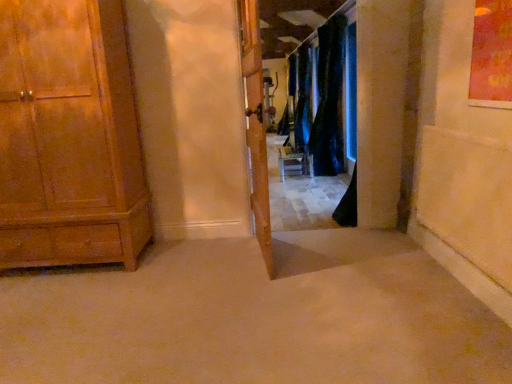
You are a GUI agent. You are given a task and a screenshot of the screen. Output one action in this format:
    pyautogui.click(x=<x>, y=<y>)
    Task: Click on the black velvet curtain at center, which is the second curtain from back to front
    
    Given the screenshot: What is the action you would take?
    pyautogui.click(x=321, y=98)

I want to click on dark blue velvet curtains at center, arranged as the 1th curtain when viewed from the back, so click(302, 99).

Where is `wooden cabinet at left`? This screenshot has height=384, width=512. wooden cabinet at left is located at coordinates (69, 137).

Locate an element on the screen. Image resolution: width=512 pixels, height=384 pixels. cabinetry that appears in front of the dark blue velvet curtains at center, arranged as the 2th curtain when viewed from the front is located at coordinates (69, 137).

From a real-world perspective, is wooden cabinet at left over dark blue velvet curtains at center, arranged as the 2th curtain when viewed from the front?

No, from a real-world perspective, wooden cabinet at left is not on top of dark blue velvet curtains at center, arranged as the 2th curtain when viewed from the front.

Considering the relative sizes of wooden cabinet at left and dark blue velvet curtains at center, arranged as the 2th curtain when viewed from the front, in the image provided, is wooden cabinet at left shorter than dark blue velvet curtains at center, arranged as the 2th curtain when viewed from the front,?

Correct, wooden cabinet at left is not as tall as dark blue velvet curtains at center, arranged as the 2th curtain when viewed from the front.

Is wooden cabinet at left aimed at dark blue velvet curtains at center, arranged as the 2th curtain when viewed from the front?

No, wooden cabinet at left is not aimed at dark blue velvet curtains at center, arranged as the 2th curtain when viewed from the front.

Is dark blue velvet curtains at center, arranged as the 1th curtain when viewed from the back, looking in the opposite direction of wooden cabinet at left?

dark blue velvet curtains at center, arranged as the 1th curtain when viewed from the back, is not turned away from wooden cabinet at left.

From a real-world perspective, which object rests below the other?

From a 3D spatial view, wooden cabinet at left is below.

Considering the relative positions of dark blue velvet curtains at center, arranged as the 1th curtain when viewed from the back, and wooden cabinet at left in the image provided, is dark blue velvet curtains at center, arranged as the 1th curtain when viewed from the back, to the left or to the right of wooden cabinet at left?

Based on their positions, dark blue velvet curtains at center, arranged as the 1th curtain when viewed from the back, is located to the right of wooden cabinet at left.

Identify the location of door that is below the black velvet curtain at center, which is the second curtain from back to front (from the image's perspective). (256, 125).

Which is in front, wooden door at center or black velvet curtain at center, which is the second curtain from back to front?

wooden door at center is closer to the camera.

Can we say wooden door at center lies outside black velvet curtain at center, which is the second curtain from back to front?

Yes, wooden door at center is outside of black velvet curtain at center, which is the second curtain from back to front.

Can you confirm if wooden door at center is shorter than black velvet curtain at center, which is counted as the 1th curtain, starting from the front?

Indeed, wooden door at center has a lesser height compared to black velvet curtain at center, which is counted as the 1th curtain, starting from the front.

Looking at this image, considering the sizes of objects wooden door at center and dark blue velvet curtains at center, arranged as the 1th curtain when viewed from the back, in the image provided, who is bigger, wooden door at center or dark blue velvet curtains at center, arranged as the 1th curtain when viewed from the back,?

Bigger between the two is dark blue velvet curtains at center, arranged as the 1th curtain when viewed from the back.

From a real-world perspective, is wooden door at center over dark blue velvet curtains at center, arranged as the 2th curtain when viewed from the front?

No, from a real-world perspective, wooden door at center is not on top of dark blue velvet curtains at center, arranged as the 2th curtain when viewed from the front.

Is wooden door at center closer to camera compared to dark blue velvet curtains at center, arranged as the 2th curtain when viewed from the front?

Yes, wooden door at center is closer to the camera.

What's the angular difference between wooden door at center and dark blue velvet curtains at center, arranged as the 2th curtain when viewed from the front,'s facing directions?

The facing directions of wooden door at center and dark blue velvet curtains at center, arranged as the 2th curtain when viewed from the front, are 7.94 degrees apart.

Which object is wider, black velvet curtain at center, which is counted as the 1th curtain, starting from the front, or dark blue velvet curtains at center, arranged as the 2th curtain when viewed from the front?

black velvet curtain at center, which is counted as the 1th curtain, starting from the front.

From a real-world perspective, is black velvet curtain at center, which is counted as the 1th curtain, starting from the front, physically below dark blue velvet curtains at center, arranged as the 2th curtain when viewed from the front?

Yes, from a real-world perspective, black velvet curtain at center, which is counted as the 1th curtain, starting from the front, is under dark blue velvet curtains at center, arranged as the 2th curtain when viewed from the front.

Looking at this image, which is more to the left, black velvet curtain at center, which is counted as the 1th curtain, starting from the front, or dark blue velvet curtains at center, arranged as the 1th curtain when viewed from the back?

Positioned to the left is black velvet curtain at center, which is counted as the 1th curtain, starting from the front.

Would you say black velvet curtain at center, which is the second curtain from back to front, is inside or outside dark blue velvet curtains at center, arranged as the 2th curtain when viewed from the front?

black velvet curtain at center, which is the second curtain from back to front, is outside dark blue velvet curtains at center, arranged as the 2th curtain when viewed from the front.

How many degrees apart are the facing directions of dark blue velvet curtains at center, arranged as the 2th curtain when viewed from the front, and black velvet curtain at center, which is the second curtain from back to front?

There is a 0.00337-degree angle between the facing directions of dark blue velvet curtains at center, arranged as the 2th curtain when viewed from the front, and black velvet curtain at center, which is the second curtain from back to front.

Identify the location of curtain that appears above the black velvet curtain at center, which is the second curtain from back to front (from a real-world perspective). Image resolution: width=512 pixels, height=384 pixels. (302, 99).

Does dark blue velvet curtains at center, arranged as the 1th curtain when viewed from the back, have a greater height compared to black velvet curtain at center, which is the second curtain from back to front?

No.

Considering their positions, is dark blue velvet curtains at center, arranged as the 2th curtain when viewed from the front, located in front of or behind black velvet curtain at center, which is counted as the 1th curtain, starting from the front?

dark blue velvet curtains at center, arranged as the 2th curtain when viewed from the front, is behind black velvet curtain at center, which is counted as the 1th curtain, starting from the front.

Looking at this image, from the image's perspective, is dark blue velvet curtains at center, arranged as the 2th curtain when viewed from the front, above or below wooden door at center?

dark blue velvet curtains at center, arranged as the 2th curtain when viewed from the front, is situated higher than wooden door at center in the image.

Considering the sizes of dark blue velvet curtains at center, arranged as the 1th curtain when viewed from the back, and wooden door at center in the image, is dark blue velvet curtains at center, arranged as the 1th curtain when viewed from the back, bigger or smaller than wooden door at center?

dark blue velvet curtains at center, arranged as the 1th curtain when viewed from the back, is bigger than wooden door at center.

Is dark blue velvet curtains at center, arranged as the 2th curtain when viewed from the front, inside or outside of wooden door at center?

dark blue velvet curtains at center, arranged as the 2th curtain when viewed from the front, is not enclosed by wooden door at center.

From a real-world perspective, who is located lower, dark blue velvet curtains at center, arranged as the 1th curtain when viewed from the back, or wooden door at center?

From a 3D spatial view, wooden door at center is below.

Identify the location of cabinetry that is under the dark blue velvet curtains at center, arranged as the 2th curtain when viewed from the front (from a real-world perspective). (69, 137).

Identify the location of cabinetry that is in front of the dark blue velvet curtains at center, arranged as the 1th curtain when viewed from the back. (69, 137).

Which object lies further to the anchor point dark blue velvet curtains at center, arranged as the 2th curtain when viewed from the front, black velvet curtain at center, which is counted as the 1th curtain, starting from the front, or wooden cabinet at left?

The object further to dark blue velvet curtains at center, arranged as the 2th curtain when viewed from the front, is wooden cabinet at left.

Which object lies nearer to the anchor point black velvet curtain at center, which is counted as the 1th curtain, starting from the front, wooden door at center or wooden cabinet at left?

wooden door at center is closer to black velvet curtain at center, which is counted as the 1th curtain, starting from the front.

Consider the image. When comparing their distances from black velvet curtain at center, which is counted as the 1th curtain, starting from the front, does wooden cabinet at left or wooden door at center seem further?

wooden cabinet at left lies further to black velvet curtain at center, which is counted as the 1th curtain, starting from the front, than the other object.

Looking at the image, which one is located closer to wooden cabinet at left, black velvet curtain at center, which is the second curtain from back to front, or dark blue velvet curtains at center, arranged as the 1th curtain when viewed from the back?

The object closer to wooden cabinet at left is black velvet curtain at center, which is the second curtain from back to front.

Looking at the image, which one is located closer to dark blue velvet curtains at center, arranged as the 1th curtain when viewed from the back, black velvet curtain at center, which is the second curtain from back to front, or wooden door at center?

black velvet curtain at center, which is the second curtain from back to front, is closer to dark blue velvet curtains at center, arranged as the 1th curtain when viewed from the back.

When comparing their distances from wooden door at center, does black velvet curtain at center, which is counted as the 1th curtain, starting from the front, or wooden cabinet at left seem further?

Among the two, black velvet curtain at center, which is counted as the 1th curtain, starting from the front, is located further to wooden door at center.

From the image, which object appears to be nearer to wooden cabinet at left, dark blue velvet curtains at center, arranged as the 2th curtain when viewed from the front, or black velvet curtain at center, which is counted as the 1th curtain, starting from the front?

black velvet curtain at center, which is counted as the 1th curtain, starting from the front.

Estimate the real-world distances between objects in this image. Which object is closer to wooden door at center, dark blue velvet curtains at center, arranged as the 1th curtain when viewed from the back, or black velvet curtain at center, which is the second curtain from back to front?

Among the two, black velvet curtain at center, which is the second curtain from back to front, is located nearer to wooden door at center.

At what (x,y) coordinates should I click in order to perform the action: click on curtain between wooden cabinet at left and dark blue velvet curtains at center, arranged as the 2th curtain when viewed from the front, from front to back. Please return your answer as a coordinate pair (x, y). Image resolution: width=512 pixels, height=384 pixels. Looking at the image, I should click on (321, 98).

The width and height of the screenshot is (512, 384). What are the coordinates of `cabinetry located between wooden door at center and dark blue velvet curtains at center, arranged as the 1th curtain when viewed from the back, in the depth direction` in the screenshot? It's located at (69, 137).

The image size is (512, 384). Identify the location of curtain positioned between wooden door at center and dark blue velvet curtains at center, arranged as the 1th curtain when viewed from the back, from near to far. (321, 98).

Image resolution: width=512 pixels, height=384 pixels. I want to click on cabinetry between wooden door at center and black velvet curtain at center, which is the second curtain from back to front, in the front-back direction, so click(x=69, y=137).